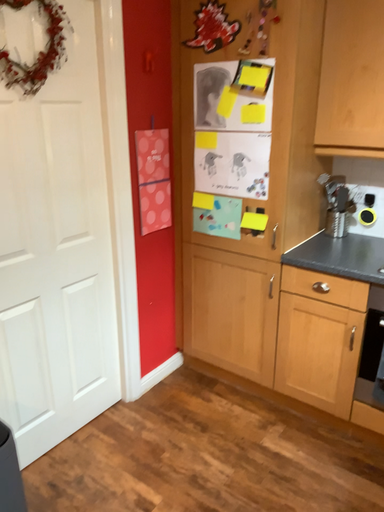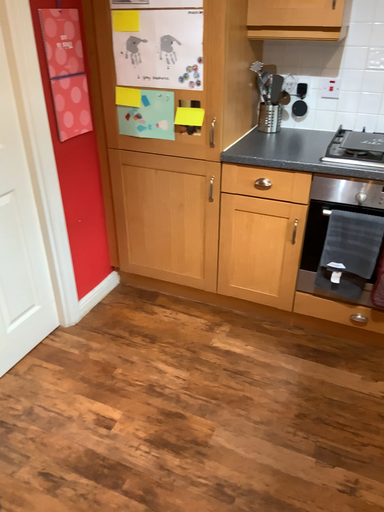
Question: How did the camera likely rotate when shooting the video?

Choices:
 (A) rotated downward
 (B) rotated upward

Answer: (A)